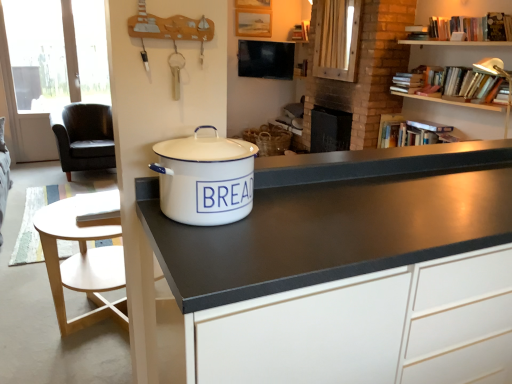
Question: Is light wood round table at lower left aimed at white matte cabinet at center?

Choices:
 (A) no
 (B) yes

Answer: (A)

Question: Is light wood round table at lower left wider than white matte cabinet at center?

Choices:
 (A) yes
 (B) no

Answer: (A)

Question: From the image's perspective, is light wood round table at lower left under white matte cabinet at center?

Choices:
 (A) no
 (B) yes

Answer: (A)

Question: Considering the relative positions of light wood round table at lower left and white matte cabinet at center in the image provided, is light wood round table at lower left to the left of white matte cabinet at center from the viewer's perspective?

Choices:
 (A) no
 (B) yes

Answer: (B)

Question: Is light wood round table at lower left oriented away from white matte cabinet at center?

Choices:
 (A) no
 (B) yes

Answer: (A)

Question: Is white matte cabinet at center to the left or to the right of black leather chair at left in the image?

Choices:
 (A) right
 (B) left

Answer: (A)

Question: Is white matte cabinet at center in front of or behind black leather chair at left in the image?

Choices:
 (A) behind
 (B) front

Answer: (B)

Question: Is white matte cabinet at center spatially inside black leather chair at left, or outside of it?

Choices:
 (A) inside
 (B) outside

Answer: (B)

Question: Looking at their shapes, would you say white matte cabinet at center is wider or thinner than black leather chair at left?

Choices:
 (A) wide
 (B) thin

Answer: (B)

Question: Considering the relative positions of light wood round table at lower left and white enamel bread bin at center in the image provided, is light wood round table at lower left to the left or to the right of white enamel bread bin at center?

Choices:
 (A) right
 (B) left

Answer: (B)

Question: Choose the correct answer: Is light wood round table at lower left inside white enamel bread bin at center or outside it?

Choices:
 (A) inside
 (B) outside

Answer: (B)

Question: Looking at the image, does light wood round table at lower left seem bigger or smaller compared to white enamel bread bin at center?

Choices:
 (A) big
 (B) small

Answer: (A)

Question: From their relative heights in the image, would you say light wood round table at lower left is taller or shorter than white enamel bread bin at center?

Choices:
 (A) short
 (B) tall

Answer: (B)

Question: Considering their positions, is hardcover books at upper right located in front of or behind light wood round table at lower left?

Choices:
 (A) behind
 (B) front

Answer: (A)

Question: Does point (476, 21) appear closer or farther from the camera than point (72, 236)?

Choices:
 (A) farther
 (B) closer

Answer: (A)